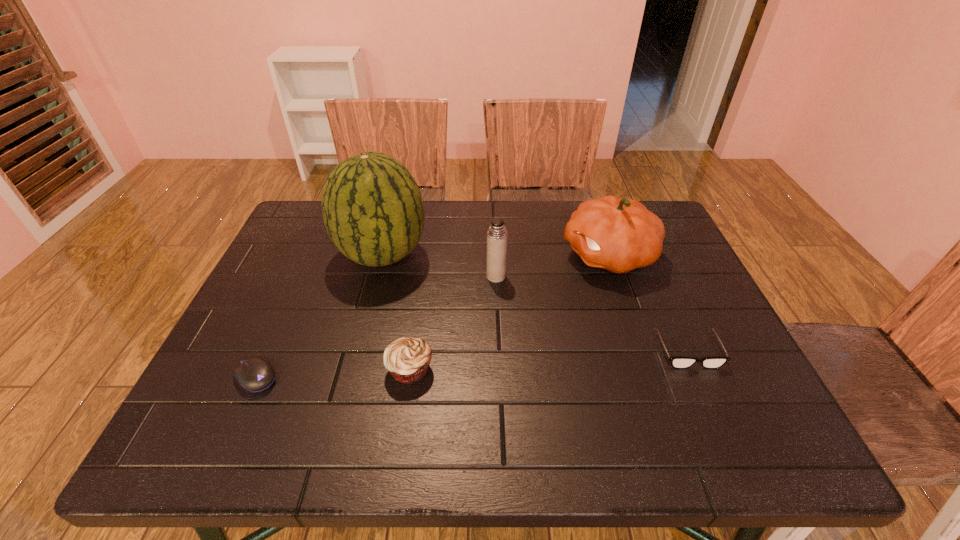
The width and height of the screenshot is (960, 540). Identify the location of empty location between the thermos bottle and the leftmost object. (376, 327).

Where is `free space between the tallest object and the thermos bottle`? The image size is (960, 540). free space between the tallest object and the thermos bottle is located at coordinates (439, 265).

Locate an element on the screen. This screenshot has width=960, height=540. unoccupied area between the muffin and the watermelon is located at coordinates (396, 312).

Select which object is the fourth closest to the muffin. Please provide its 2D coordinates. Your answer should be formatted as a tuple, i.e. [(x, y)], where the tuple contains the x and y coordinates of a point satisfying the conditions above.

[(619, 235)]

Locate which object is the third closest to the spectacles. Please provide its 2D coordinates. Your answer should be formatted as a tuple, i.e. [(x, y)], where the tuple contains the x and y coordinates of a point satisfying the conditions above.

[(407, 359)]

Locate an element on the screen. vacant region that satisfies the following two spatial constraints: 1. on the front face of the pumpkin; 2. on the front side of the computer mouse is located at coordinates (651, 377).